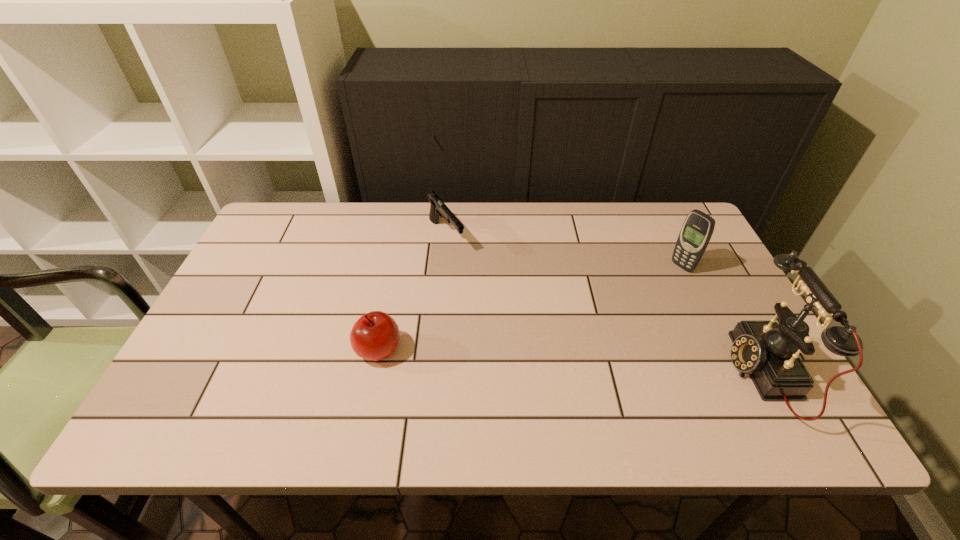
At what (x,y) coordinates should I click in order to perform the action: click on apple. Please return your answer as a coordinate pair (x, y). The width and height of the screenshot is (960, 540). Looking at the image, I should click on (375, 336).

The width and height of the screenshot is (960, 540). Find the location of `telephone`. telephone is located at coordinates (768, 351).

You are a GUI agent. You are given a task and a screenshot of the screen. Output one action in this format:
    pyautogui.click(x=<x>, y=<y>)
    Task: Click on the third nearest object
    Image resolution: width=960 pixels, height=540 pixels.
    Given the screenshot: What is the action you would take?
    pyautogui.click(x=697, y=229)

Locate an element on the screen. the third shortest object is located at coordinates (697, 229).

Locate an element on the screen. This screenshot has height=540, width=960. the third object from right to left is located at coordinates (438, 208).

Locate an element on the screen. Image resolution: width=960 pixels, height=540 pixels. gun is located at coordinates (438, 208).

Locate an element on the screen. The height and width of the screenshot is (540, 960). vacant space located on the left of the apple is located at coordinates (220, 350).

You are a GUI agent. You are given a task and a screenshot of the screen. Output one action in this format:
    pyautogui.click(x=<x>, y=<y>)
    Task: Click on the vacant space located 0.360m on the dial of the telephone
    
    Given the screenshot: What is the action you would take?
    pyautogui.click(x=575, y=373)

This screenshot has height=540, width=960. Find the location of `vacant space located 0.350m on the dial of the telephone`. vacant space located 0.350m on the dial of the telephone is located at coordinates (580, 373).

Where is `vacant space situated on the dial of the telephone`? This screenshot has width=960, height=540. vacant space situated on the dial of the telephone is located at coordinates (593, 373).